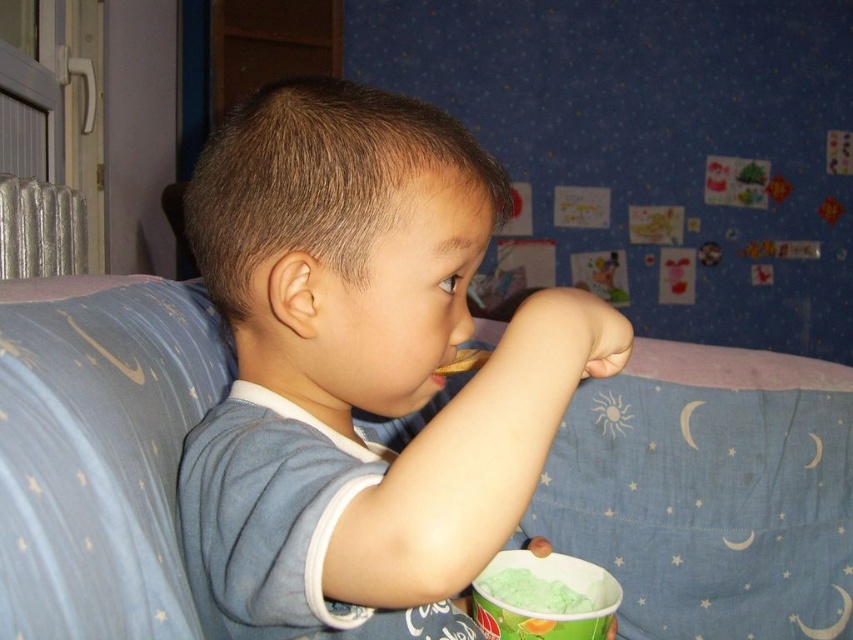
Question: Among these points, which one is nearest to the camera?

Choices:
 (A) (520, 540)
 (B) (553, 605)
 (C) (469, 353)
 (D) (514, 588)

Answer: (C)

Question: Which point is farther to the camera?

Choices:
 (A) (198, 305)
 (B) (424, 177)
 (C) (517, 556)

Answer: (A)

Question: In this image, where is green matte ice cream at lower center located relative to brown crumbly cookie at lower center?

Choices:
 (A) below
 (B) above

Answer: (A)

Question: Which object appears closest to the camera in this image?

Choices:
 (A) green matte ice cream at lower center
 (B) brown crumbly cookie at lower center
 (C) green matte yogurt cup at lower center

Answer: (B)

Question: Does smooth blue shirt at center have a larger size compared to green matte ice cream at lower center?

Choices:
 (A) no
 (B) yes

Answer: (B)

Question: Is smooth blue shirt at center thinner than blue fabric bed at center?

Choices:
 (A) yes
 (B) no

Answer: (A)